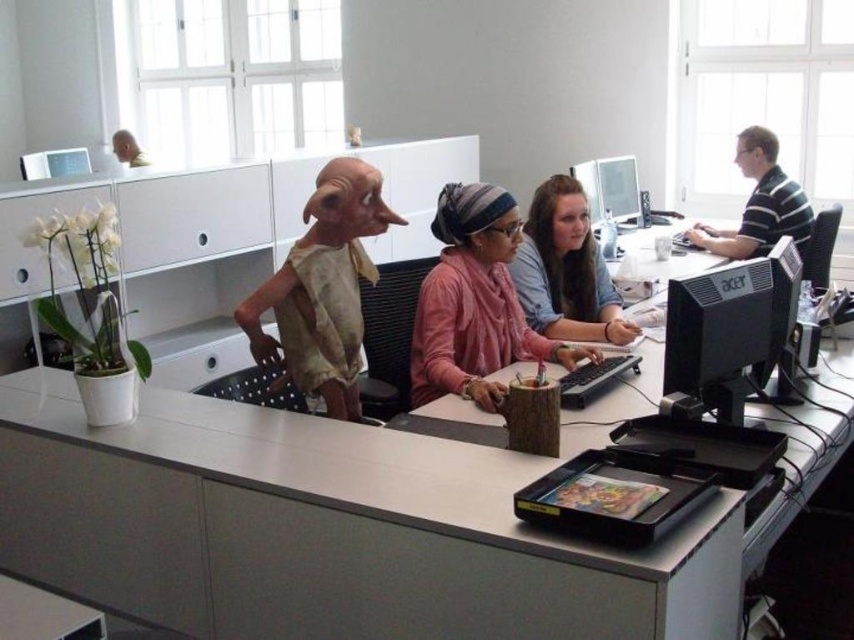
How much distance is there between striped polo shirt at right and white matte head at upper center?

4.85 meters

Who is positioned more to the right, striped polo shirt at right or white matte head at upper center?

striped polo shirt at right is more to the right.

Measure the distance between point [805,241] and camera.

The distance of point [805,241] from camera is 3.96 meters.

What are the coordinates of `striped polo shirt at right` in the screenshot? It's located at (759, 204).

Describe the element at coordinates (730, 328) in the screenshot. Image resolution: width=854 pixels, height=640 pixels. I see `black plastic monitor at center right` at that location.

Is black plastic monitor at center right closer to the viewer compared to white matte head at upper center?

Yes, it is in front of white matte head at upper center.

In order to click on black plastic monitor at center right in this screenshot , I will do (x=730, y=328).

Does pink fabric at center appear on the right side of matte black monitor at upper right?

In fact, pink fabric at center is to the left of matte black monitor at upper right.

Find the location of `pink fabric at center`. pink fabric at center is located at coordinates 474,301.